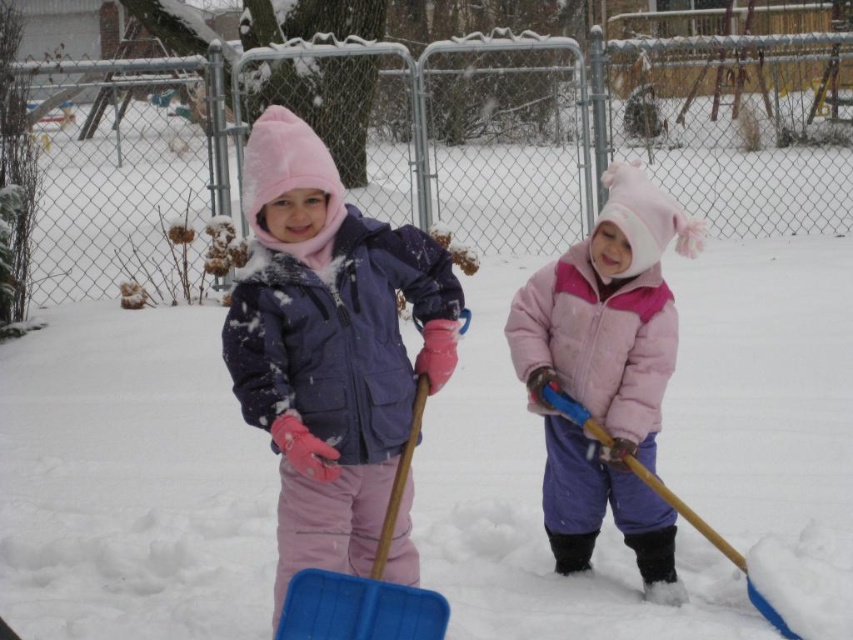
Is pink fuzzy winter coat at center thinner than blue plastic shovel at center?

No, pink fuzzy winter coat at center is not thinner than blue plastic shovel at center.

Is point (578, 557) behind point (418, 404)?

Yes, it is behind point (418, 404).

Where is `pink fuzzy winter coat at center`? The width and height of the screenshot is (853, 640). pink fuzzy winter coat at center is located at coordinates tap(606, 374).

Can you confirm if matte purple jacket at center is thinner than blue plastic shovel at center?

Incorrect, matte purple jacket at center's width is not less than blue plastic shovel at center's.

Does point (325, 509) lie in front of point (318, 580)?

No, (325, 509) is behind (318, 580).

Locate an element on the screen. matte purple jacket at center is located at coordinates 329,346.

Can you confirm if matte purple jacket at center is positioned below pink fuzzy winter coat at center?

Actually, matte purple jacket at center is above pink fuzzy winter coat at center.

Can you confirm if matte purple jacket at center is positioned to the left of pink fuzzy winter coat at center?

Correct, you'll find matte purple jacket at center to the left of pink fuzzy winter coat at center.

Where is `matte purple jacket at center`? This screenshot has height=640, width=853. matte purple jacket at center is located at coordinates (329, 346).

Find the location of a particular element. matte purple jacket at center is located at coordinates (329, 346).